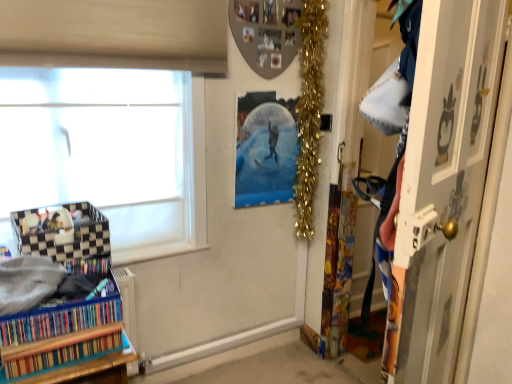
Question: Considering the positions of gold tinsel garland at upper right and multicolored cardboard book at lower left, which is counted as the 1th book, starting from the bottom, in the image, is gold tinsel garland at upper right taller or shorter than multicolored cardboard book at lower left, which is counted as the 1th book, starting from the bottom,?

Choices:
 (A) short
 (B) tall

Answer: (B)

Question: Based on their sizes in the image, would you say gold tinsel garland at upper right is bigger or smaller than multicolored cardboard book at lower left, which is counted as the 1th book, starting from the bottom?

Choices:
 (A) big
 (B) small

Answer: (A)

Question: Considering the real-world distances, which object is closest to the gold tinsel garland at upper right?

Choices:
 (A) metallic silver snow globe at upper center
 (B) wooden door at right
 (C) multicolored cardboard at lower left, placed as the 1th book when sorted from top to bottom
 (D) white frosted glass window at left
 (E) multicolored cardboard book at lower left, which is counted as the 1th book, starting from the bottom

Answer: (A)

Question: Which is farther from the multicolored cardboard at lower left, placed as the 1th book when sorted from top to bottom?

Choices:
 (A) multicolored cardboard book at lower left, which is counted as the 1th book, starting from the bottom
 (B) gold tinsel garland at upper right
 (C) white frosted glass window at left
 (D) metallic silver snow globe at upper center
 (E) wooden door at right

Answer: (B)